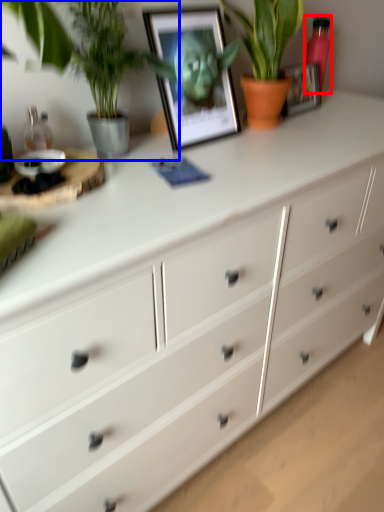
Question: Which object appears farthest to the camera in this image, bottle (highlighted by a red box) or houseplant (highlighted by a blue box)?

Choices:
 (A) bottle
 (B) houseplant

Answer: (A)